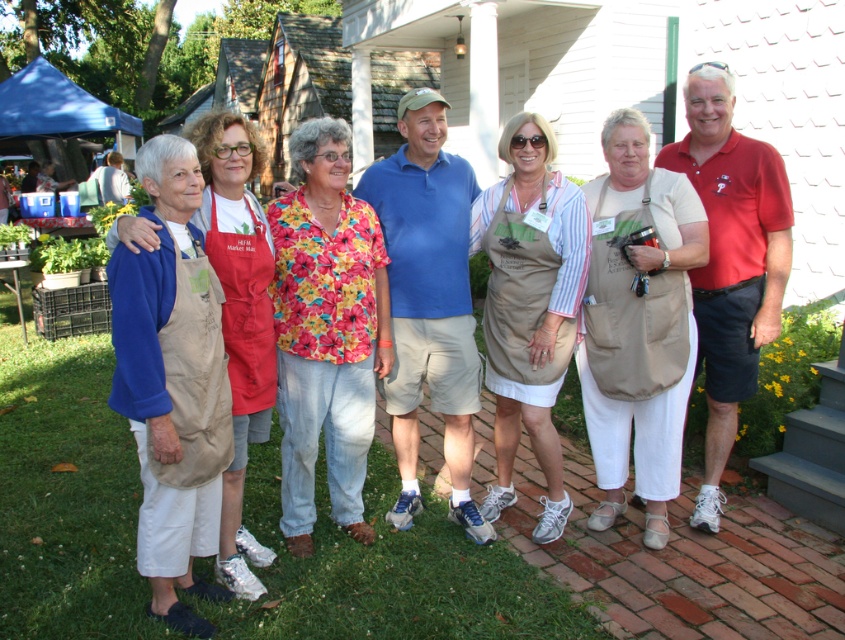
Does beige fabric apron at left have a lesser width compared to tan fabric apron at center?

Correct, beige fabric apron at left's width is less than tan fabric apron at center's.

Between point (159, 248) and point (644, 444), which one is positioned in front?

Point (159, 248) is in front.

The image size is (845, 640). Identify the location of beige fabric apron at left. [169, 380].